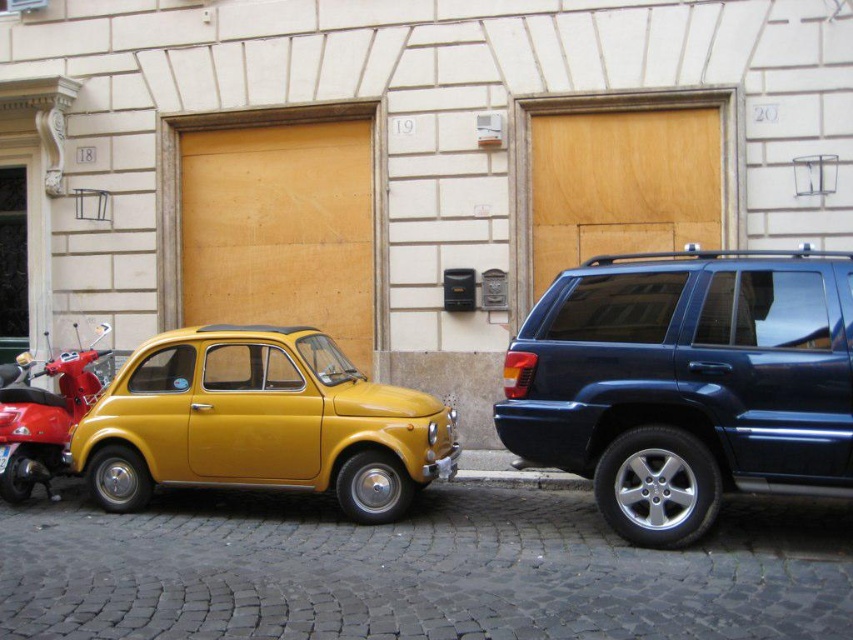
Question: Which of the following is the closest to the observer?

Choices:
 (A) shiny dark blue minivan at right
 (B) shiny red scooter at left
 (C) yellow matte car at center

Answer: (A)

Question: Is yellow matte car at center to the left of shiny red scooter at left from the viewer's perspective?

Choices:
 (A) no
 (B) yes

Answer: (A)

Question: Which object is the closest to the yellow matte car at center?

Choices:
 (A) shiny red scooter at left
 (B) shiny dark blue minivan at right

Answer: (A)

Question: Can you confirm if yellow matte car at center is smaller than shiny red scooter at left?

Choices:
 (A) yes
 (B) no

Answer: (B)

Question: Which of the following is the farthest from the observer?

Choices:
 (A) (6, 442)
 (B) (280, 371)

Answer: (A)

Question: Does shiny dark blue minivan at right come in front of shiny red scooter at left?

Choices:
 (A) no
 (B) yes

Answer: (B)